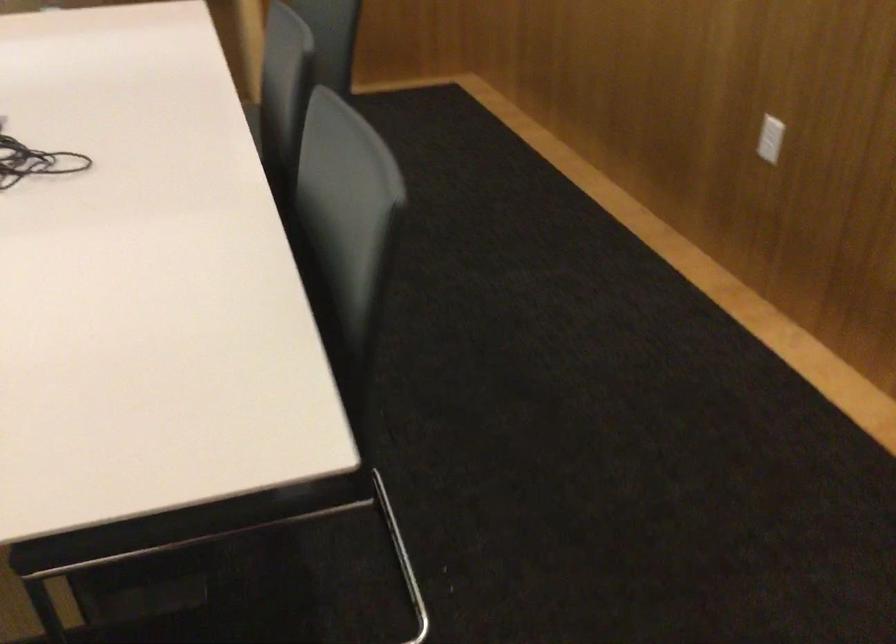
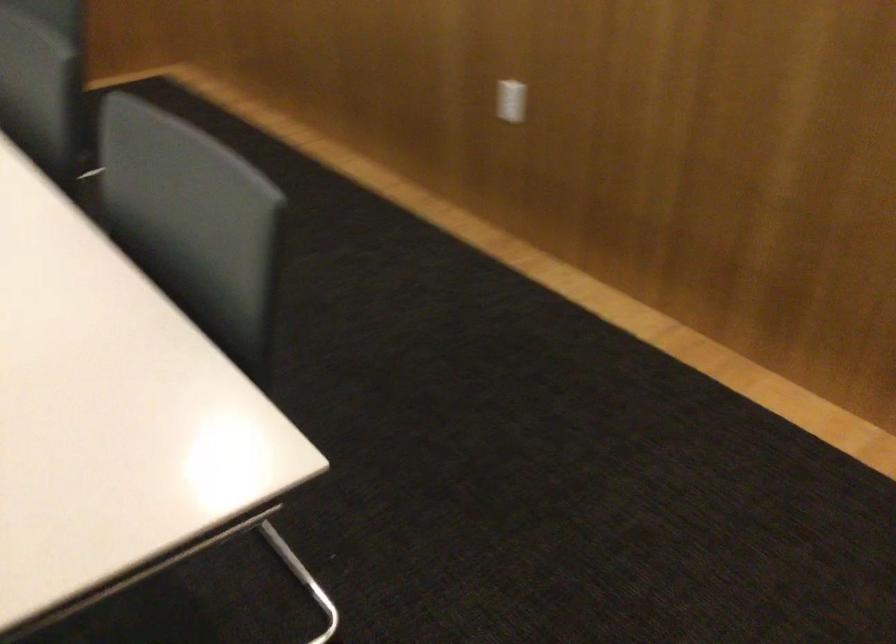
Question: The first image is from the beginning of the video and the second image is from the end. How did the camera likely rotate when shooting the video?

Choices:
 (A) Left
 (B) Right
 (C) Up
 (D) Down

Answer: (B)